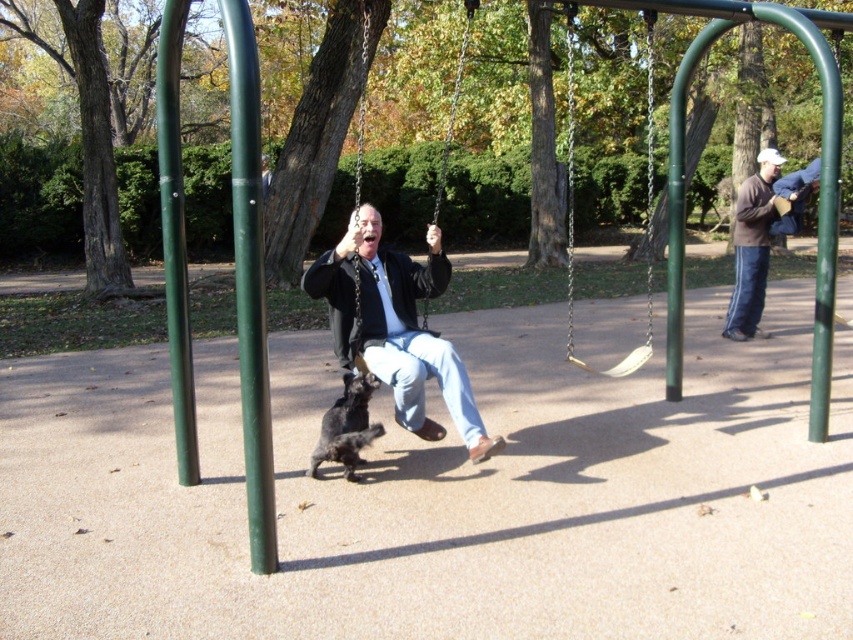
Question: Which of the following is the farthest from the observer?

Choices:
 (A) (175, 436)
 (B) (567, 344)

Answer: (B)

Question: Which of the following is the farthest from the observer?

Choices:
 (A) (233, 42)
 (B) (166, 64)
 (C) (567, 45)

Answer: (C)

Question: Is matte black jacket at center below green metallic pole at left?

Choices:
 (A) yes
 (B) no

Answer: (A)

Question: Is matte black jacket at center thinner than green metallic pole at left?

Choices:
 (A) no
 (B) yes

Answer: (A)

Question: Does matte black jacket at center lie behind green metallic pole at center?

Choices:
 (A) no
 (B) yes

Answer: (B)

Question: Which object is the closest to the green metallic pole at center?

Choices:
 (A) beige fabric swing at center
 (B) brown sweater at right
 (C) green metallic pole at left

Answer: (C)